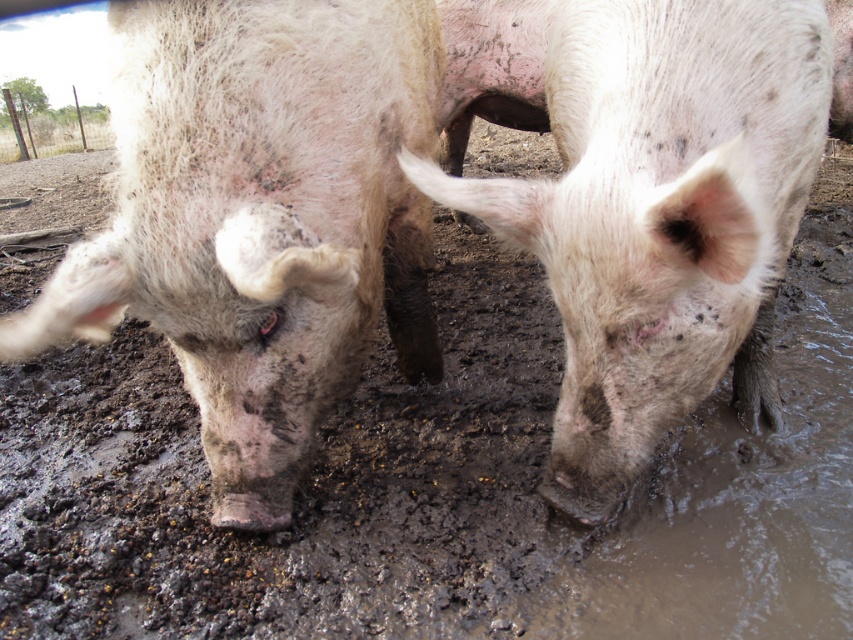
You are a farmer observing the pigs in the muddy environment. You notice a point at coordinates (260, 218). What does this point correspond to on the pigs?

The point at coordinates (260, 218) corresponds to the dirty pink skin at center.

You are a farmer checking the pigs in the muddy area. You notice two pigs at the center of the image. Which one has a larger body size between the dirty pink skin at center and the speckled muddy pig at center?

The dirty pink skin at center is bigger than the speckled muddy pig at center according to the description.

You are a farmer observing the pigs in the muddy environment. You notice two pigs at the center of the image. Which one has a higher height between the dirty pink skin at center and the speckled muddy pig at center?

The dirty pink skin at center is much taller than the speckled muddy pig at center, so the dirty pink skin at center is the taller one.